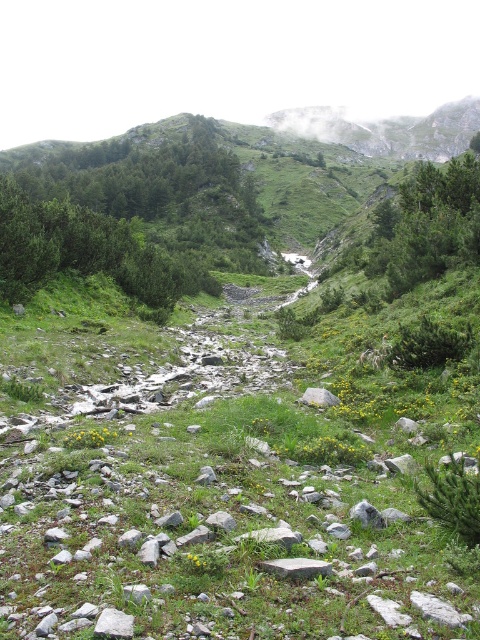
You are a hiker navigating the rugged terrain and need to cross the stream. You see a gray granite rock at center and a gray rock at center. Which rock should you step on first to reach the other side?

You should step on the gray granite rock at center first because it is in front of the gray rock at center, making it closer to your current position.

You are a hiker who wants to take a photo of the green leafy shrubs at upper left. You are currently standing at the point marked by the coordinates point (132, 218). Is there a clear path to walk towards the shrubs without crossing the stream or gully?

The green leafy shrubs at upper left is represented by point (132, 218), so you are already at the location of the shrubs. Therefore, there is no need to move further.

You are a hiker trying to cross the stream in the center of the mountainous landscape. There is a gray granite rock at center. Can you step on it to cross?

The gray granite rock at center is located at point (297, 566), so yes, you can step on the gray granite rock at center to cross the stream.